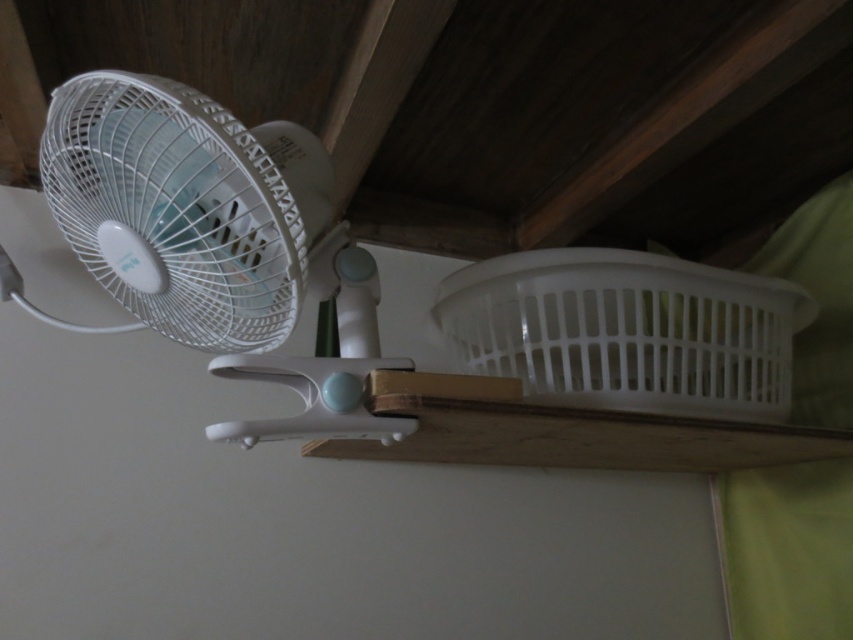
You are trying to decide whether to place a new decorative item on the wooden shelf. The shelf currently has the white plastic fan at left and the white plastic basket at upper center. Based on their sizes, which object would require more vertical space on the shelf?

The white plastic fan at left requires more vertical space because it is much taller than the white plastic basket at upper center.

You are organizing items in a room and see the white plastic fan at left and the white plastic basket at upper center. Which item is located higher up in the room?

The white plastic fan at left is positioned over the white plastic basket at upper center, so it is higher up.

You are trying to determine if the white plastic fan at left can fit into the white plastic basket at upper center. Based on their sizes, can the fan fit inside the basket?

The white plastic fan at left has a lesser width compared to the white plastic basket at upper center, so the fan can fit inside the basket.